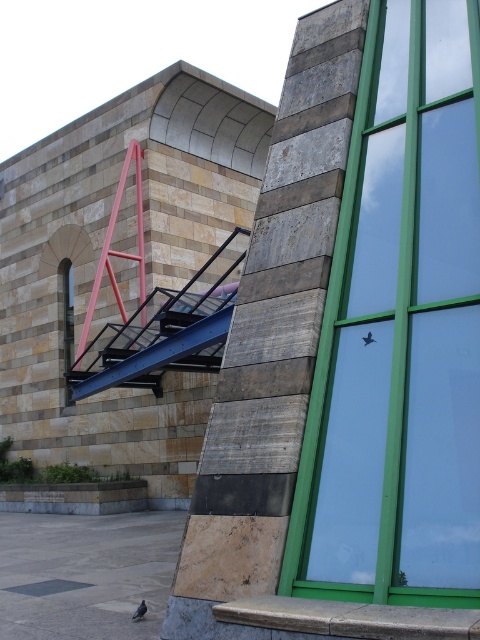
Who is more forward, (350,339) or (232,262)?

Point (350,339)

In the scene shown: Between green glass window at center and blue metallic stair at center, which one has less height?

green glass window at center is shorter.

Image resolution: width=480 pixels, height=640 pixels. What do you see at coordinates (399, 332) in the screenshot?
I see `green glass window at center` at bounding box center [399, 332].

The height and width of the screenshot is (640, 480). What are the coordinates of `green glass window at center` in the screenshot? It's located at (399, 332).